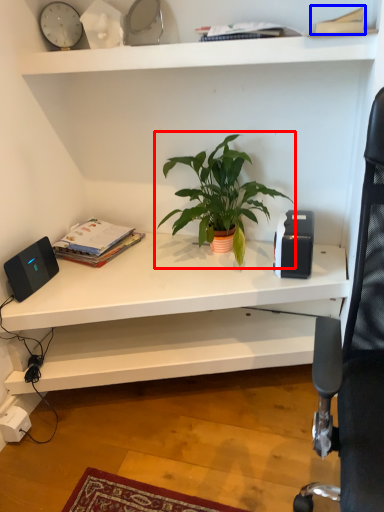
Question: Which object is further to the camera taking this photo, houseplant (highlighted by a red box) or paperback book (highlighted by a blue box)?

Choices:
 (A) houseplant
 (B) paperback book

Answer: (A)